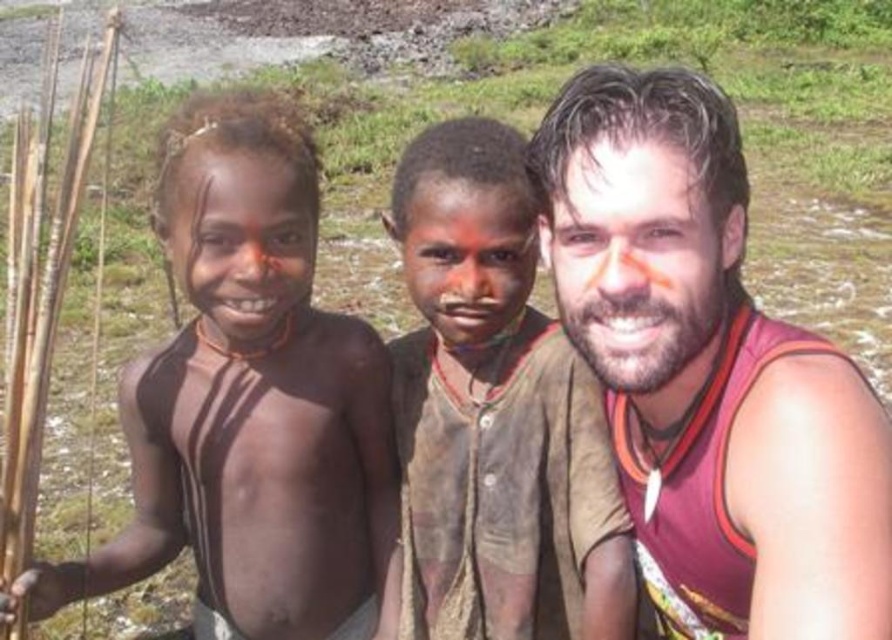
You are standing in the rural area and see the matte red tank top at right and the brown mud face at center. Which object is positioned to the right side?

The matte red tank top at right is positioned to the right of the brown mud face at center.